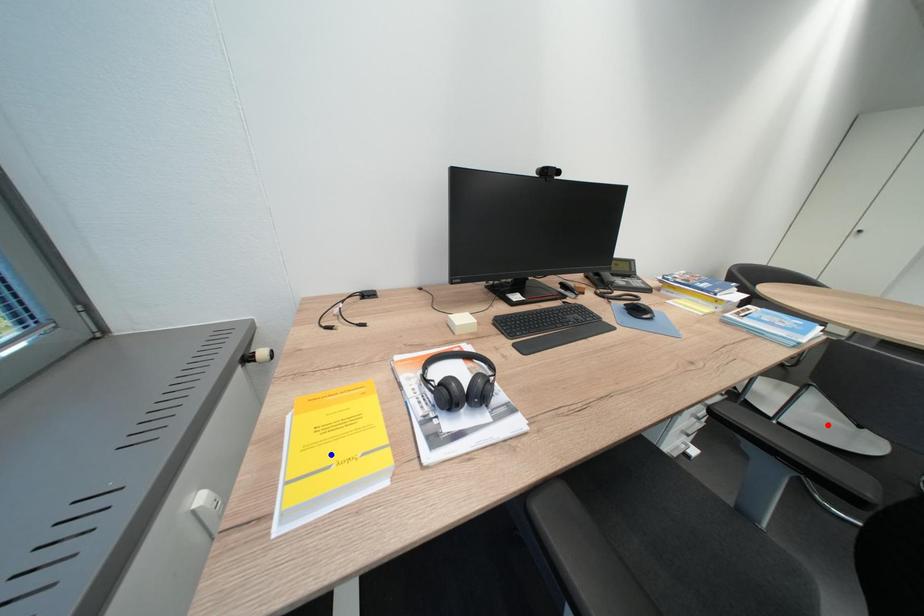
Question: In the image, two points are highlighted. Which point is nearer to the camera? Reply with the corresponding letter.

Choices:
 (A) blue point
 (B) red point

Answer: (A)